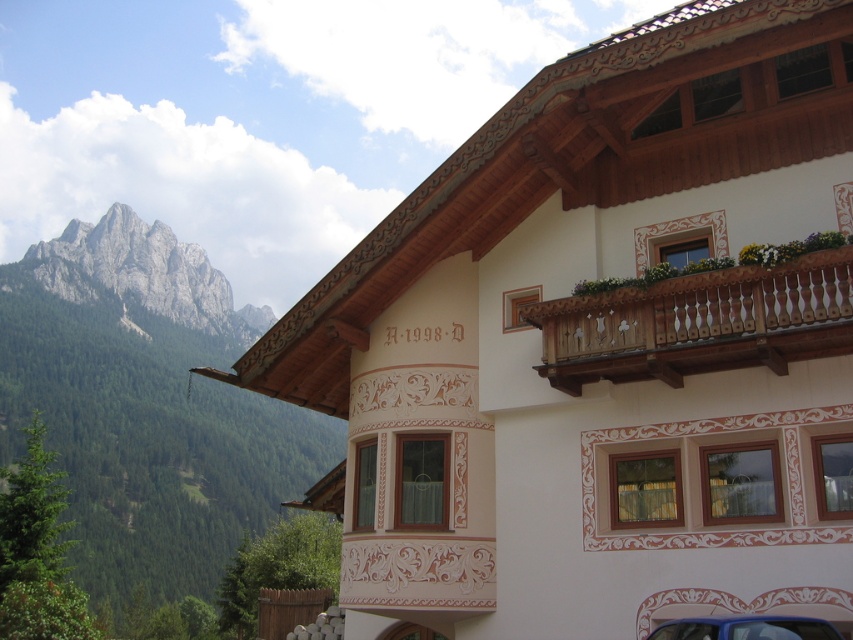
Does rugged stone mountain at left have a greater width compared to gray rocky mountain at upper left?

Yes.

Which of these two, rugged stone mountain at left or gray rocky mountain at upper left, stands shorter?

With less height is gray rocky mountain at upper left.

Who is more distant from viewer, [151,595] or [151,294]?

The point [151,294] is more distant.

Find the location of a particular element. This screenshot has width=853, height=640. rugged stone mountain at left is located at coordinates (146, 404).

Between gray rocky mountain at upper left and blue glossy car at lower right, which one has more height?

gray rocky mountain at upper left

Is point (78, 282) farther from viewer compared to point (717, 621)?

Yes, point (78, 282) is behind point (717, 621).

Between point (103, 252) and point (747, 624), which one is positioned in front?

Point (747, 624) is in front.

Where is `gray rocky mountain at upper left`? gray rocky mountain at upper left is located at coordinates (144, 273).

The image size is (853, 640). What do you see at coordinates (699, 323) in the screenshot?
I see `wooden at upper right` at bounding box center [699, 323].

Which is behind, point (566, 310) or point (817, 632)?

The point (566, 310) is behind.

Find the location of a particular element. The height and width of the screenshot is (640, 853). wooden at upper right is located at coordinates (699, 323).